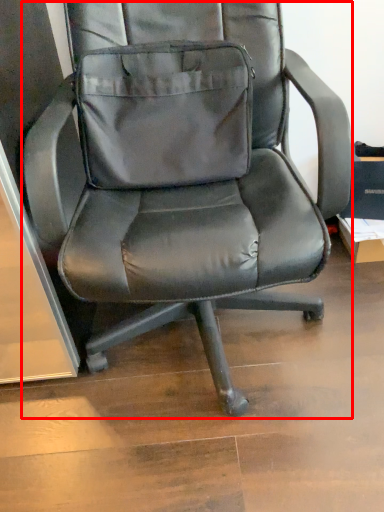
Question: From the image, what is the correct spatial relationship of chair (annotated by the red box) in relation to pocket?

Choices:
 (A) left
 (B) right

Answer: (B)